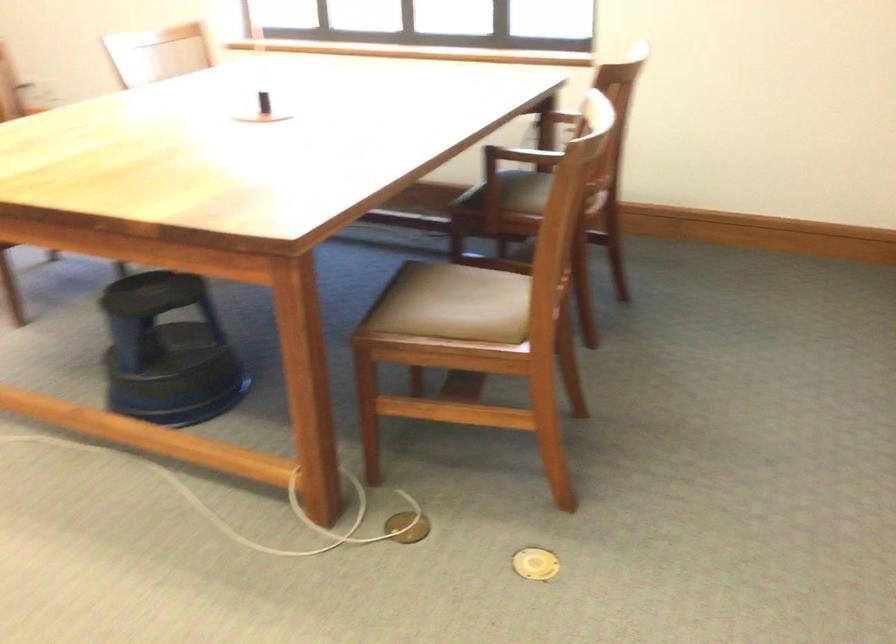
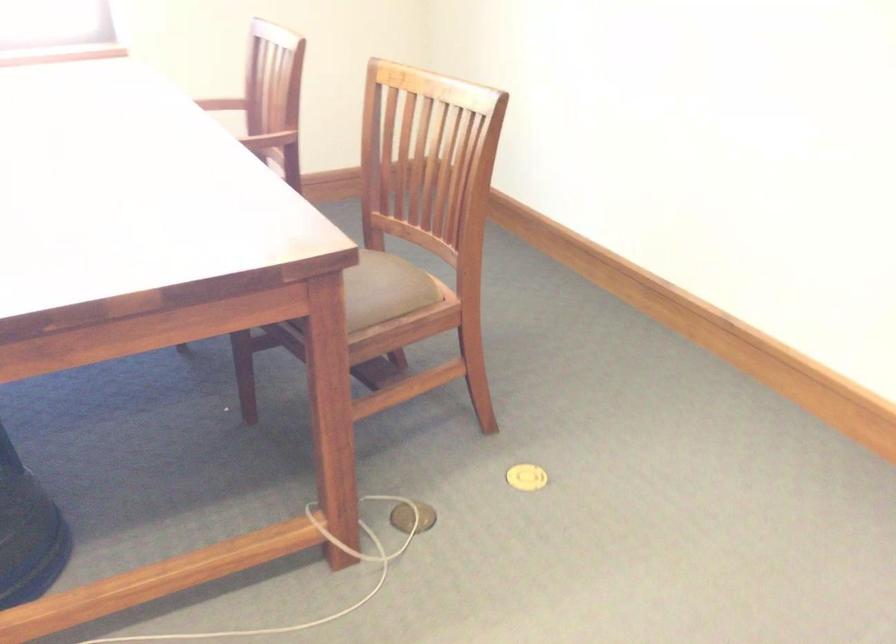
The point at (538, 562) is marked in the first image. Where is the corresponding point in the second image?

(526, 477)